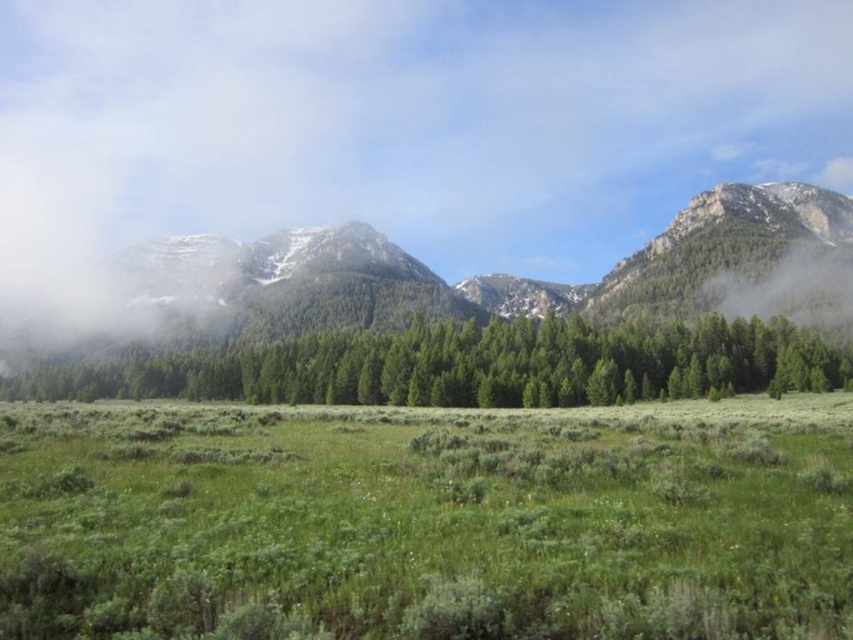
Between point (517, 166) and point (299, 376), which one is positioned behind?

The point (517, 166) is more distant.

Does white fluffy cloud at upper center appear under green matte forest at center?

Actually, white fluffy cloud at upper center is above green matte forest at center.

Locate an element on the screen. This screenshot has height=640, width=853. white fluffy cloud at upper center is located at coordinates (399, 125).

This screenshot has height=640, width=853. I want to click on white fluffy cloud at upper center, so click(x=399, y=125).

Is point (439, 234) farther from camera compared to point (784, 570)?

Yes, it is.

Does white fluffy cloud at upper center have a lesser width compared to green soft grass at center?

No.

Does point (354, 188) come farther from viewer compared to point (403, 570)?

Yes, point (354, 188) is farther from viewer.

The width and height of the screenshot is (853, 640). Find the location of `white fluffy cloud at upper center`. white fluffy cloud at upper center is located at coordinates (399, 125).

Is green soft grass at center to the right of green matte forest at center from the viewer's perspective?

Correct, you'll find green soft grass at center to the right of green matte forest at center.

Who is more forward, (358,541) or (502,346)?

Positioned in front is point (358,541).

Is point (622, 572) positioned after point (560, 323)?

No, it is not.

You are a GUI agent. You are given a task and a screenshot of the screen. Output one action in this format:
    pyautogui.click(x=<x>, y=<y>)
    Task: Click on the green soft grass at center
    
    Given the screenshot: What is the action you would take?
    pyautogui.click(x=426, y=522)